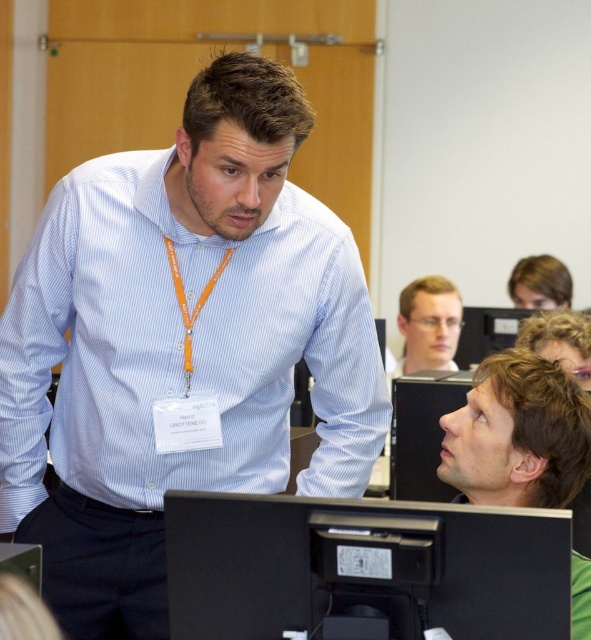
Consider the image. You are a photographer trying to capture a portrait of both individuals in the scene. The dark brown hair at lower right and the black plastic monitor at lower center are both in the frame. Considering their sizes, which object should you focus on to ensure both are clearly visible in the photo?

Since the dark brown hair at lower right is wider than the black plastic monitor at lower center, focusing on the dark brown hair at lower right would help ensure both are clearly visible as it requires more space in the frame.

You are a new trainee in the classroom. You need to hand a document to the person wearing the blue striped shirt at center. The document is on the table near the clear plastic glasses at center. Can you reach the document without moving from your current position?

The blue striped shirt at center and clear plastic glasses at center are 6.49 feet apart. Since the document is 6.49 feet away from the blue striped shirt at center, you would need to move closer to retrieve it.